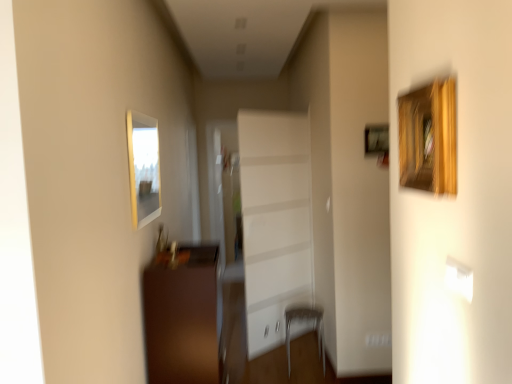
Identify the location of matte wooden picture frame at upper left. The height and width of the screenshot is (384, 512). (143, 168).

This screenshot has width=512, height=384. Describe the element at coordinates (143, 168) in the screenshot. I see `matte wooden picture frame at upper left` at that location.

Describe the element at coordinates (274, 221) in the screenshot. I see `white glossy cabinet at center` at that location.

The height and width of the screenshot is (384, 512). Identify the location of matte wooden picture frame at upper left. (143, 168).

Is point (272, 269) closer to camera compared to point (206, 277)?

No, it is behind (206, 277).

Visually, is white glossy cabinet at center positioned to the left or to the right of brown wooden cabinet at lower left?

Clearly, white glossy cabinet at center is on the right of brown wooden cabinet at lower left in the image.

From the image's perspective, is white glossy cabinet at center on brown wooden cabinet at lower left?

→ Correct, white glossy cabinet at center appears higher than brown wooden cabinet at lower left in the image.

Can you see white glossy cabinet at center touching brown wooden cabinet at lower left?

white glossy cabinet at center is not next to brown wooden cabinet at lower left, and they're not touching.

Looking at this image, from a real-world perspective, does matte wooden picture frame at upper left sit lower than metallic silver armchair at lower center?

No, from a real-world perspective, matte wooden picture frame at upper left is not under metallic silver armchair at lower center.

Between matte wooden picture frame at upper left and metallic silver armchair at lower center, which one has larger width?

metallic silver armchair at lower center.

Can you tell me how much matte wooden picture frame at upper left and metallic silver armchair at lower center differ in facing direction?

matte wooden picture frame at upper left and metallic silver armchair at lower center are facing 179 degrees away from each other.

Based on their sizes in the image, would you say matte wooden picture frame at upper left is bigger or smaller than brown wooden cabinet at lower left?

A: In the image, matte wooden picture frame at upper left appears to be smaller than brown wooden cabinet at lower left.

Considering the points (150, 207) and (145, 274), which point is in front, point (150, 207) or point (145, 274)?

Point (145, 274)

From a real-world perspective, does matte wooden picture frame at upper left stand above brown wooden cabinet at lower left?

Yes, from a real-world perspective, matte wooden picture frame at upper left is above brown wooden cabinet at lower left.

Considering the relative sizes of metallic silver armchair at lower center and brown wooden cabinet at lower left in the image provided, is metallic silver armchair at lower center wider than brown wooden cabinet at lower left?

In fact, metallic silver armchair at lower center might be narrower than brown wooden cabinet at lower left.

Which of these two, metallic silver armchair at lower center or brown wooden cabinet at lower left, stands shorter?

Standing shorter between the two is metallic silver armchair at lower center.

Is metallic silver armchair at lower center aimed at brown wooden cabinet at lower left?

No, metallic silver armchair at lower center is not oriented towards brown wooden cabinet at lower left.

Is metallic silver armchair at lower center directly adjacent to brown wooden cabinet at lower left?

metallic silver armchair at lower center and brown wooden cabinet at lower left are clearly separated.

Is white glossy cabinet at center next to matte wooden picture frame at upper left?

white glossy cabinet at center is not next to matte wooden picture frame at upper left, and they're not touching.

In terms of size, does white glossy cabinet at center appear bigger or smaller than matte wooden picture frame at upper left?

Clearly, white glossy cabinet at center is larger in size than matte wooden picture frame at upper left.

From a real-world perspective, is white glossy cabinet at center positioned over matte wooden picture frame at upper left based on gravity?

No, from a real-world perspective, white glossy cabinet at center is not on top of matte wooden picture frame at upper left.

Considering the relative sizes of metallic silver armchair at lower center and matte wooden picture frame at upper left in the image provided, is metallic silver armchair at lower center taller than matte wooden picture frame at upper left?

No.

Is metallic silver armchair at lower center directly adjacent to matte wooden picture frame at upper left?

There is a gap between metallic silver armchair at lower center and matte wooden picture frame at upper left.

Is metallic silver armchair at lower center at the left side of matte wooden picture frame at upper left?

In fact, metallic silver armchair at lower center is to the right of matte wooden picture frame at upper left.

Between brown wooden cabinet at lower left and white glossy cabinet at center, which one has smaller width?

Thinner between the two is white glossy cabinet at center.

Considering the relative positions of brown wooden cabinet at lower left and white glossy cabinet at center in the image provided, is brown wooden cabinet at lower left to the left of white glossy cabinet at center from the viewer's perspective?

Correct, you'll find brown wooden cabinet at lower left to the left of white glossy cabinet at center.

Is point (201, 351) closer or farther from the camera than point (271, 319)?

Clearly, point (201, 351) is closer to the camera than point (271, 319).

Consider the image. Would you say brown wooden cabinet at lower left is outside white glossy cabinet at center?

brown wooden cabinet at lower left lies outside white glossy cabinet at center's area.

What are the coordinates of `furniture on the left of the white glossy cabinet at center` in the screenshot? It's located at (181, 316).

Locate an element on the screen. picture frame that is in front of the metallic silver armchair at lower center is located at coordinates (143, 168).

Looking at the image, which one is located further to matte wooden picture frame at upper left, brown wooden cabinet at lower left or white glossy cabinet at center?

white glossy cabinet at center.

When comparing their distances from white glossy cabinet at center, does brown wooden cabinet at lower left or metallic silver armchair at lower center seem closer?

metallic silver armchair at lower center lies closer to white glossy cabinet at center than the other object.

When comparing their distances from brown wooden cabinet at lower left, does matte wooden picture frame at upper left or white glossy cabinet at center seem closer?

matte wooden picture frame at upper left lies closer to brown wooden cabinet at lower left than the other object.

Based on their spatial positions, is white glossy cabinet at center or matte wooden picture frame at upper left closer to metallic silver armchair at lower center?

white glossy cabinet at center lies closer to metallic silver armchair at lower center than the other object.

Based on their spatial positions, is metallic silver armchair at lower center or brown wooden cabinet at lower left closer to white glossy cabinet at center?

Among the two, metallic silver armchair at lower center is located nearer to white glossy cabinet at center.

Estimate the real-world distances between objects in this image. Which object is closer to matte wooden picture frame at upper left, metallic silver armchair at lower center or brown wooden cabinet at lower left?

brown wooden cabinet at lower left is positioned closer to the anchor matte wooden picture frame at upper left.

When comparing their distances from brown wooden cabinet at lower left, does white glossy cabinet at center or metallic silver armchair at lower center seem closer?

white glossy cabinet at center.

From the image, which object appears to be nearer to brown wooden cabinet at lower left, metallic silver armchair at lower center or white glossy cabinet at center?

white glossy cabinet at center is closer to brown wooden cabinet at lower left.

You are a GUI agent. You are given a task and a screenshot of the screen. Output one action in this format:
    pyautogui.click(x=<x>, y=<y>)
    Task: Click on the furniture between matte wooden picture frame at upper left and metallic silver armchair at lower center in the vertical direction
    This screenshot has height=384, width=512.
    Given the screenshot: What is the action you would take?
    pyautogui.click(x=181, y=316)

The image size is (512, 384). I want to click on armchair located between matte wooden picture frame at upper left and white glossy cabinet at center in the depth direction, so click(305, 320).

Find the location of a particular element. The width and height of the screenshot is (512, 384). furniture between matte wooden picture frame at upper left and white glossy cabinet at center in the front-back direction is located at coordinates (181, 316).

This screenshot has height=384, width=512. I want to click on armchair between brown wooden cabinet at lower left and white glossy cabinet at center in the front-back direction, so click(305, 320).